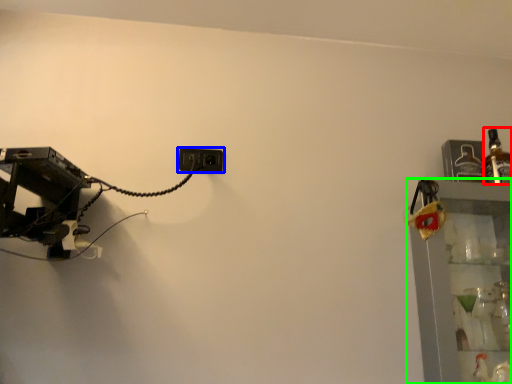
Question: Estimate the real-world distances between objects in this image. Which object is closer to bottle (highlighted by a red box), power plugs and sockets (highlighted by a blue box) or shelf (highlighted by a green box)?

Choices:
 (A) power plugs and sockets
 (B) shelf

Answer: (B)